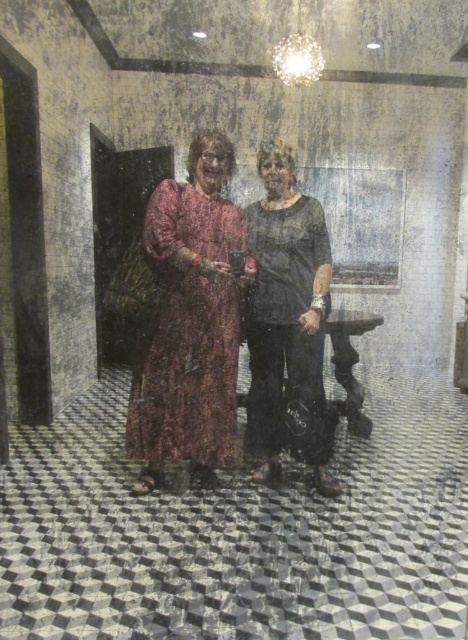
Question: Can you confirm if patterned fabric dress at center is bigger than floral-patterned fabric dress at center?

Choices:
 (A) no
 (B) yes

Answer: (B)

Question: Which object is closer to the camera taking this photo?

Choices:
 (A) patterned fabric dress at center
 (B) matte black shirt at center
 (C) floral-patterned fabric dress at center

Answer: (C)

Question: Is the position of floral-patterned fabric dress at center less distant than that of matte black shirt at center?

Choices:
 (A) yes
 (B) no

Answer: (A)

Question: Can you confirm if patterned fabric dress at center is positioned above matte black shirt at center?

Choices:
 (A) yes
 (B) no

Answer: (A)

Question: Which point is farther to the camera?

Choices:
 (A) [x=151, y=253]
 (B) [x=176, y=408]

Answer: (B)

Question: Which object is positioned closest to the matte black shirt at center?

Choices:
 (A) patterned fabric dress at center
 (B) floral-patterned fabric dress at center

Answer: (A)